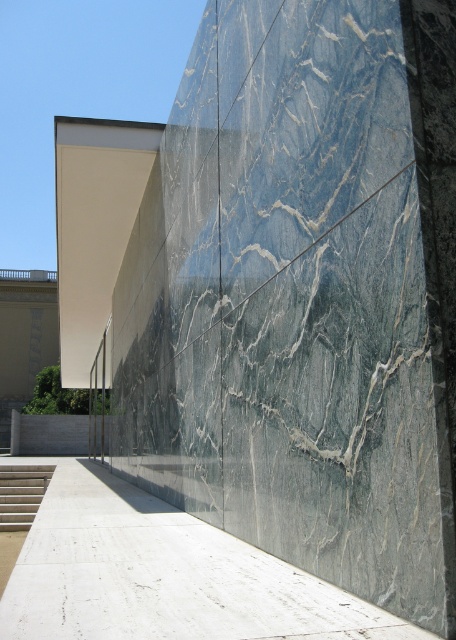
Measure the distance between point (409, 621) and camera.

The distance of point (409, 621) from camera is 3.20 meters.

Who is positioned more to the left, white polished concrete at lower center or white concrete stairs at lower left?

From the viewer's perspective, white concrete stairs at lower left appears more on the left side.

Is point (174, 579) closer to viewer compared to point (45, 465)?

Yes, it is.

What are the coordinates of `white polished concrete at lower center` in the screenshot? It's located at (164, 576).